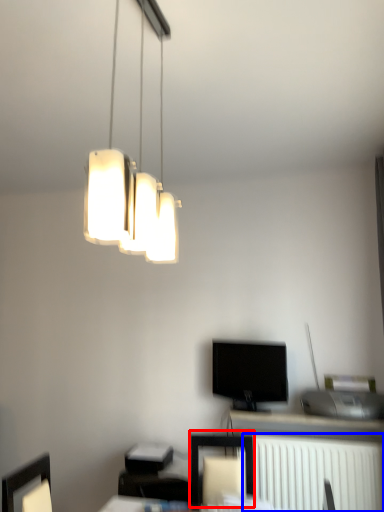
Question: Which object appears farthest to the camera in this image, furniture (highlighted by a red box) or radiator (highlighted by a blue box)?

Choices:
 (A) furniture
 (B) radiator

Answer: (B)